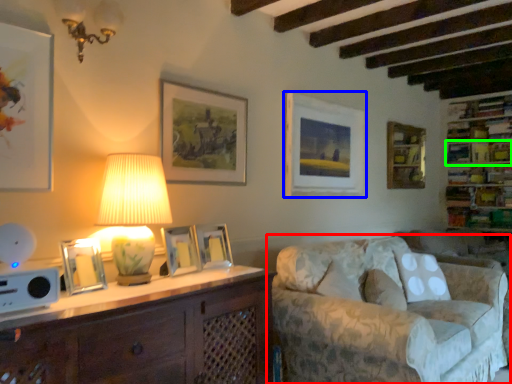
Question: Which object is the farthest from studio couch (highlighted by a red box)? Choose among these: picture frame (highlighted by a blue box) or shelf (highlighted by a green box).

Choices:
 (A) picture frame
 (B) shelf

Answer: (B)